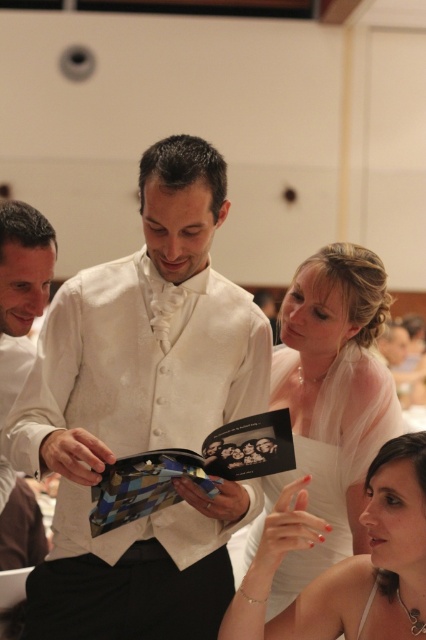
Consider the image. Who is higher up, white satin suit at center or white satin dress at lower right?

white satin suit at center

Between white satin suit at center and white satin dress at lower right, which one has more height?

Standing taller between the two is white satin suit at center.

Is point (224, 538) in front of point (389, 628)?

No, (224, 538) is further to viewer.

Where is `white satin suit at center`? Image resolution: width=426 pixels, height=640 pixels. white satin suit at center is located at coordinates (143, 413).

Is white satin suit at center below white satin dress at center?

No.

Does point (74, 518) come in front of point (313, 500)?

Yes, it is in front of point (313, 500).

Who is more distant from viewer, (66, 420) or (367, 355)?

Point (367, 355)

Where is `white satin suit at center`? The image size is (426, 640). white satin suit at center is located at coordinates (143, 413).

Measure the distance between white satin dress at center and camera.

2.05 meters

Can you confirm if white satin dress at center is thinner than white satin dress at lower right?

Yes, white satin dress at center is thinner than white satin dress at lower right.

This screenshot has width=426, height=640. What are the coordinates of `white satin dress at center` in the screenshot? It's located at (331, 401).

Find the location of a particular element. The image size is (426, 640). white satin dress at center is located at coordinates (331, 401).